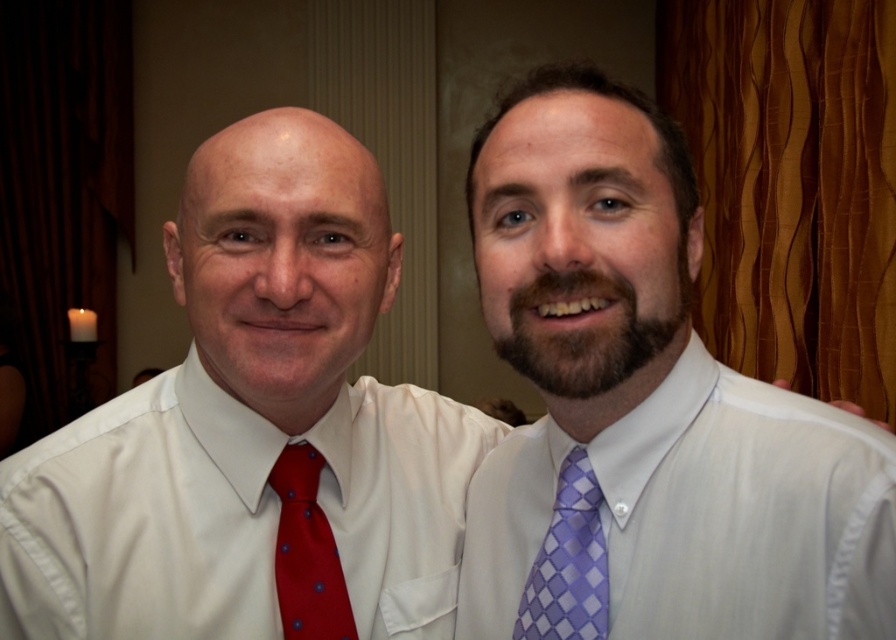
Question: Is purple checkered tie at center wider than polka dot silk tie at left?

Choices:
 (A) yes
 (B) no

Answer: (B)

Question: Does matte white shirt at center have a greater width compared to polka dot silk tie at left?

Choices:
 (A) no
 (B) yes

Answer: (B)

Question: Which object appears farthest from the camera in this image?

Choices:
 (A) matte white shirt at center
 (B) polka dot silk tie at left
 (C) white satin dress shirt at right
 (D) purple checkered tie at center

Answer: (B)

Question: Is white satin dress shirt at right to the left of polka dot silk tie at left from the viewer's perspective?

Choices:
 (A) yes
 (B) no

Answer: (B)

Question: Considering the real-world distances, which object is closest to the purple checkered tie at center?

Choices:
 (A) white satin dress shirt at right
 (B) matte white shirt at center

Answer: (A)

Question: Which of the following is the closest to the observer?

Choices:
 (A) (313, 598)
 (B) (571, 497)

Answer: (B)